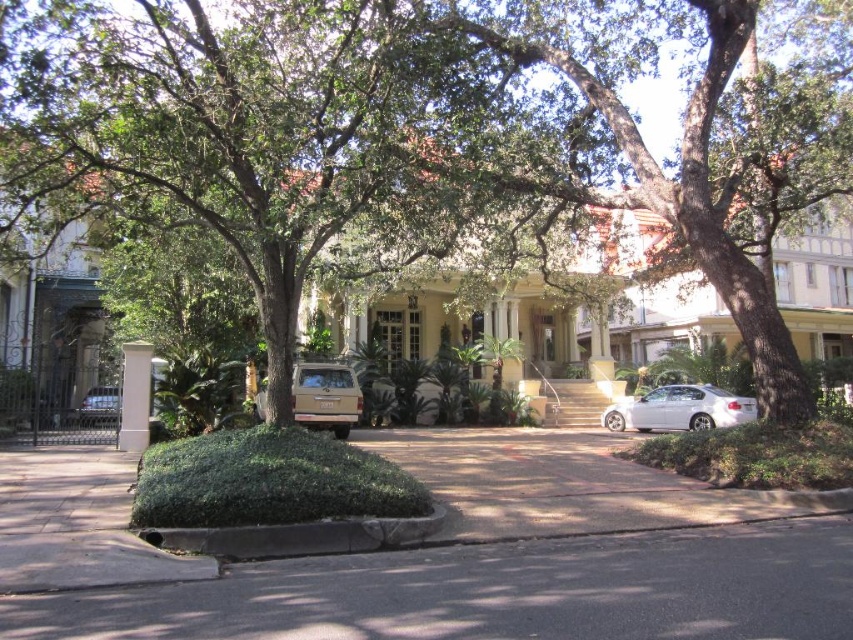
Does green leafy tree at center have a lesser height compared to metallic gold suv at center?

No.

Which is more to the right, green leafy tree at center or metallic gold suv at center?

From the viewer's perspective, green leafy tree at center appears more on the right side.

Locate an element on the screen. green leafy tree at center is located at coordinates (428, 136).

In the scene shown: Who is higher up, gold matte suv at center or white painted wood column at center?

white painted wood column at center is above.

Can you confirm if gold matte suv at center is taller than white painted wood column at center?

In fact, gold matte suv at center may be shorter than white painted wood column at center.

Image resolution: width=853 pixels, height=640 pixels. What do you see at coordinates (325, 396) in the screenshot?
I see `gold matte suv at center` at bounding box center [325, 396].

The image size is (853, 640). I want to click on gold matte suv at center, so 325,396.

Is point (39, 612) farther from camera compared to point (151, 349)?

No, it is in front of (151, 349).

Consider the image. Between dark gray asphalt at center and white painted wood column at center, which one has more height?

white painted wood column at center is taller.

You are a GUI agent. You are given a task and a screenshot of the screen. Output one action in this format:
    pyautogui.click(x=<x>, y=<y>)
    Task: Click on the dark gray asphalt at center
    This screenshot has height=640, width=853.
    Given the screenshot: What is the action you would take?
    pyautogui.click(x=514, y=561)